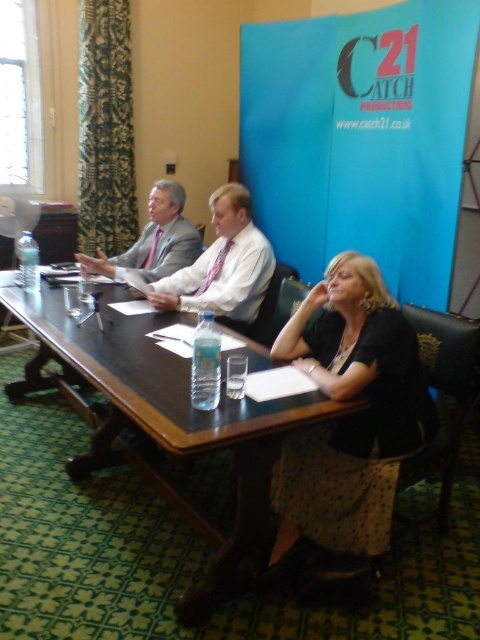
Which of these two, dark wood table at center or matte pink tie at center, stands shorter?

Standing shorter between the two is matte pink tie at center.

Is the position of dark wood table at center more distant than that of matte pink tie at center?

No.

Who is more forward, (x=229, y=580) or (x=175, y=291)?

Point (x=229, y=580)

Locate an element on the screen. Image resolution: width=480 pixels, height=640 pixels. dark wood table at center is located at coordinates (164, 417).

Who is higher up, dark wood table at center or matte gray suit at center?

Positioned higher is matte gray suit at center.

Can you confirm if dark wood table at center is positioned to the right of matte gray suit at center?

In fact, dark wood table at center is to the left of matte gray suit at center.

Where is `dark wood table at center`? Image resolution: width=480 pixels, height=640 pixels. dark wood table at center is located at coordinates (164, 417).

Is point (315, 435) farther from camera compared to point (222, 230)?

No.

Is black textured blouse at center closer to camera compared to matte pink tie at center?

Yes.

Measure the distance between black textured blouse at center and camera.

The distance of black textured blouse at center from camera is 5.88 feet.

Image resolution: width=480 pixels, height=640 pixels. Identify the location of black textured blouse at center. (350, 413).